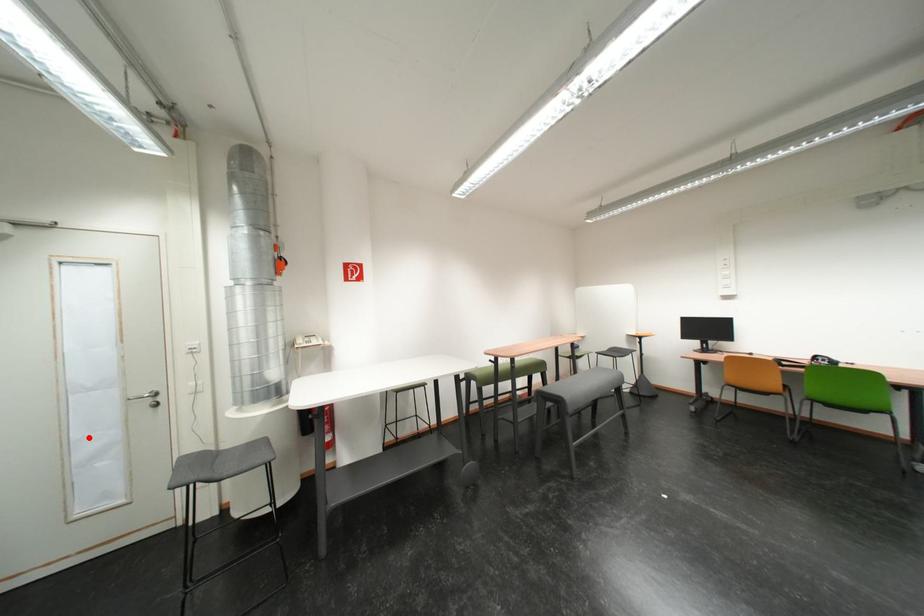
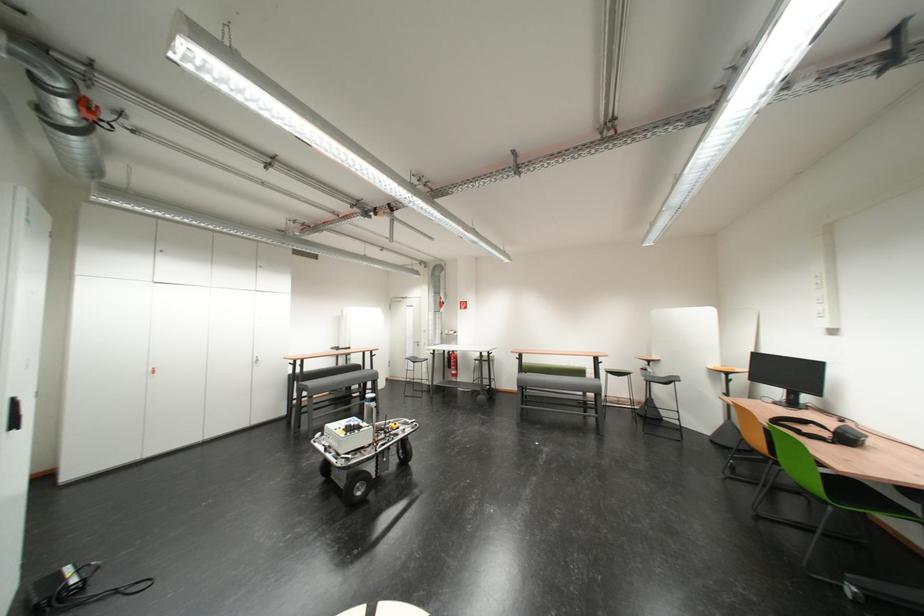
Question: I am providing you with two images of the same scene from different viewpoints. A red point is shown in image1. For the corresponding object point in image2, is it positioned nearer or farther from the camera?

Choices:
 (A) Nearer
 (B) Farther

Answer: (B)